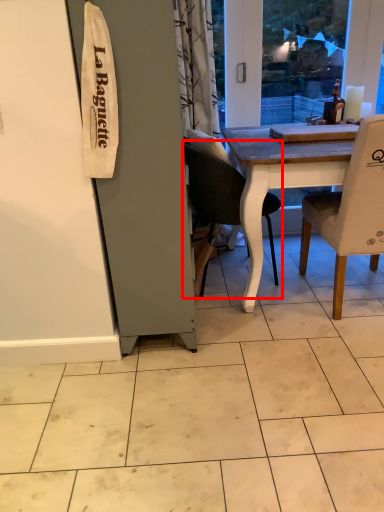
Question: From the image's perspective, where is chair (annotated by the red box) located in relation to chair in the image?

Choices:
 (A) below
 (B) above

Answer: (B)